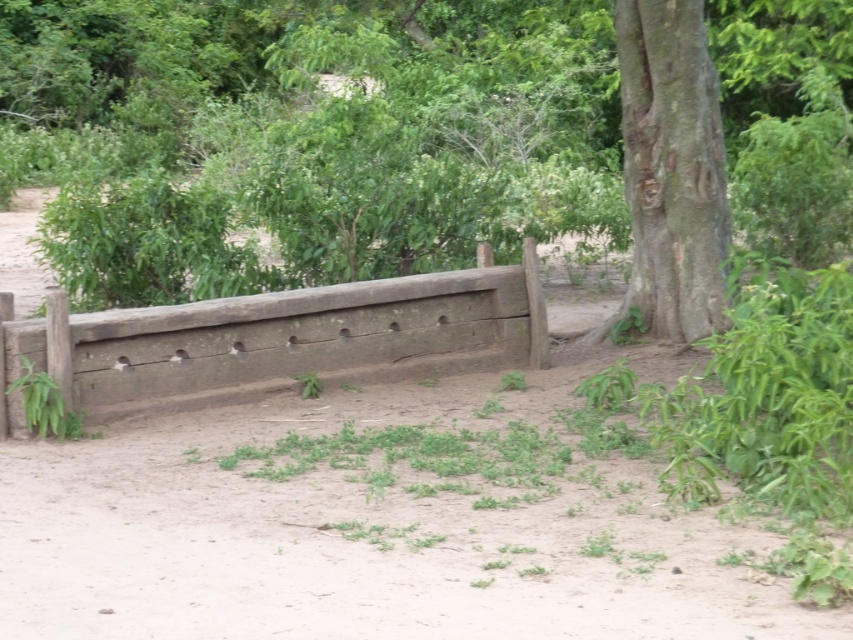
Question: Does brown wood tree at center have a larger size compared to weathered wood fence at center?

Choices:
 (A) yes
 (B) no

Answer: (A)

Question: Which object appears closest to the camera in this image?

Choices:
 (A) brown wood tree at center
 (B) weathered wood fence at center
 (C) brown rough bark tree at right

Answer: (B)

Question: Is the position of weathered wood fence at center less distant than that of brown rough bark tree at right?

Choices:
 (A) yes
 (B) no

Answer: (A)

Question: Which of the following is the farthest from the observer?

Choices:
 (A) brown rough bark tree at right
 (B) weathered wood fence at center
 (C) brown wood tree at center

Answer: (C)

Question: Does weathered wood fence at center have a lesser width compared to brown rough bark tree at right?

Choices:
 (A) yes
 (B) no

Answer: (B)

Question: Among these points, which one is nearest to the camera?

Choices:
 (A) (477, 292)
 (B) (705, 330)
 (C) (735, 12)

Answer: (A)